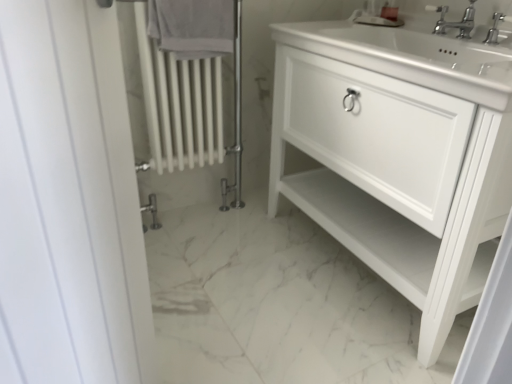
Where is `free space to the right of clear plastic soap dispenser at upper center`? The height and width of the screenshot is (384, 512). free space to the right of clear plastic soap dispenser at upper center is located at coordinates (417, 27).